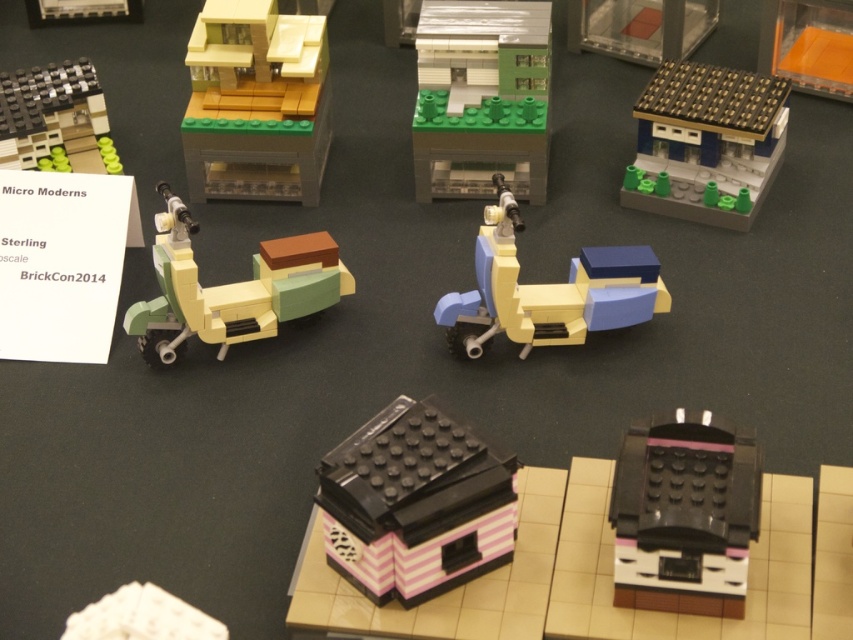
Question: Which of the following is the closest to the observer?

Choices:
 (A) (184, 259)
 (B) (53, 138)
 (C) (625, 294)

Answer: (A)

Question: Can you confirm if pink striped plastic house at center is positioned to the left of translucent orange plastic at upper right?

Choices:
 (A) yes
 (B) no

Answer: (A)

Question: Which of the following is the farthest from the observer?

Choices:
 (A) (85, 632)
 (B) (622, 472)
 (C) (212, 173)

Answer: (C)

Question: Among these points, which one is nearest to the camera?

Choices:
 (A) (648, 449)
 (B) (453, 435)
 (C) (639, 56)
 (D) (444, 184)

Answer: (B)

Question: Does matte plastic container at upper center appear under white matte cube at lower left?

Choices:
 (A) no
 (B) yes

Answer: (A)

Question: Is pink matte house at lower right positioned at the back of green matte building at center?

Choices:
 (A) no
 (B) yes

Answer: (A)